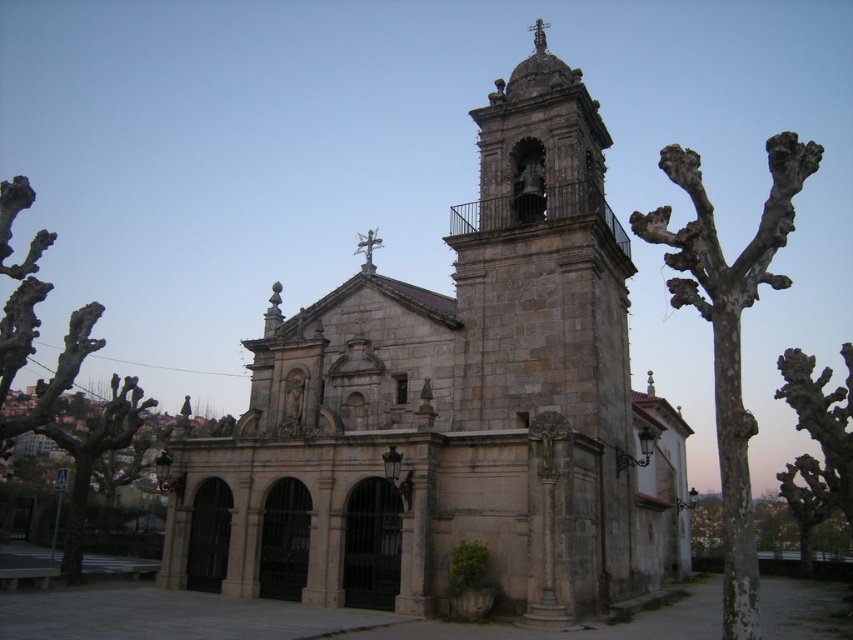
Can you confirm if stone church at center is positioned above bare branches at left?

Incorrect, stone church at center is not positioned above bare branches at left.

Does stone church at center have a lesser height compared to bare branches at left?

In fact, stone church at center may be taller than bare branches at left.

Who is more distant from viewer, [271,337] or [131,406]?

The point [271,337] is behind.

Locate an element on the screen. The width and height of the screenshot is (853, 640). stone church at center is located at coordinates (453, 408).

Which is behind, point (827, 515) or point (376, 243)?

Positioned behind is point (827, 515).

Is bare wood tree at right above polished stone cross at center?

Actually, bare wood tree at right is below polished stone cross at center.

Find the location of a particular element. Image resolution: width=853 pixels, height=640 pixels. bare wood tree at right is located at coordinates (817, 444).

Does point (787, 148) come in front of point (65, 384)?

That is True.

You are a GUI agent. You are given a task and a screenshot of the screen. Output one action in this format:
    pyautogui.click(x=<x>, y=<y>)
    Task: Click on the bark textured tree at right
    Image resolution: width=853 pixels, height=640 pixels.
    Given the screenshot: What is the action you would take?
    pyautogui.click(x=729, y=333)

Is point (740, 540) less distant than point (76, 502)?

Yes, point (740, 540) is closer to viewer.

This screenshot has height=640, width=853. What are the coordinates of `bark textured tree at right` in the screenshot? It's located at (729, 333).